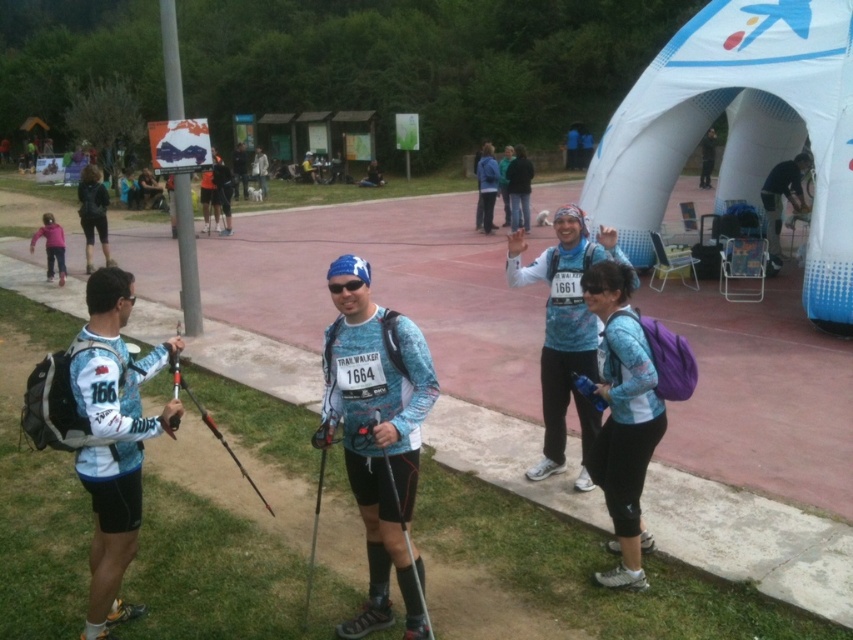
Based on the scene description, where is the blue fabric jacket at upper center located in terms of coordinates?

The blue fabric jacket at upper center is located at coordinates point (486, 186).

You are an event organizer checking the participants for safety gear. You notice the blue fabric jacket at upper center and the matte black ski pole at left. Which item is larger in size?

The blue fabric jacket at upper center is bigger than the matte black ski pole at left.